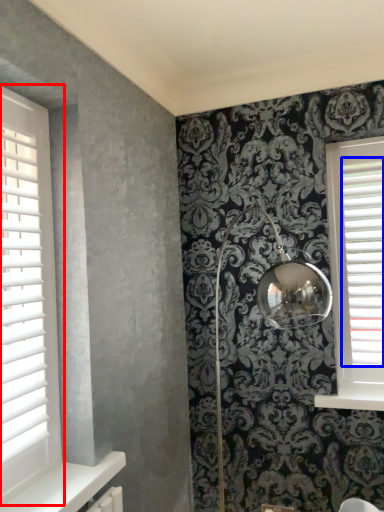
Question: Which of the following is the closest to the observer, window (highlighted by a red box) or blind (highlighted by a blue box)?

Choices:
 (A) window
 (B) blind

Answer: (A)